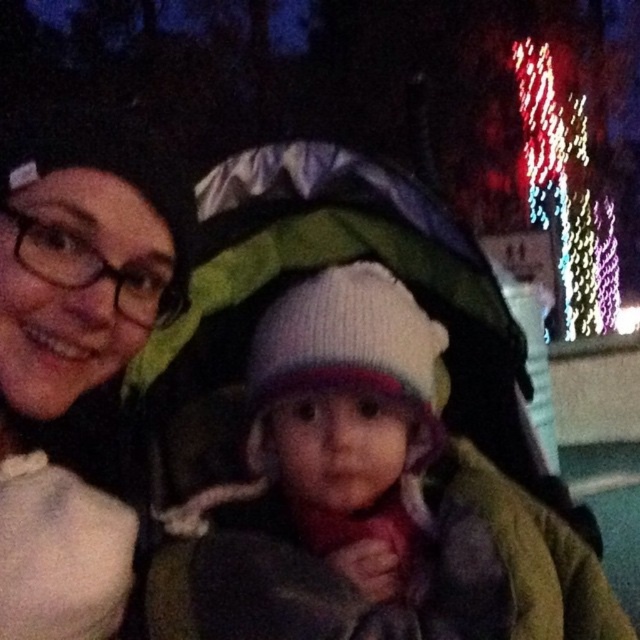
Is matte black beanie at upper left shorter than multicolored fabric baby carriage at center?

No.

Identify the location of matte black beanie at upper left. (76, 355).

The image size is (640, 640). Find the location of `matte black beanie at upper left`. matte black beanie at upper left is located at coordinates (76, 355).

Which is above, white knitted hat at center or multicolored fabric baby carriage at center?

multicolored fabric baby carriage at center is higher up.

Which is more to the left, white knitted hat at center or multicolored fabric baby carriage at center?

white knitted hat at center

Which is in front, point (216, 634) or point (499, 333)?

Point (216, 634) is more forward.

Image resolution: width=640 pixels, height=640 pixels. In order to click on white knitted hat at center in this screenshot , I will do `click(353, 472)`.

Based on the photo, who is more forward, (538, 493) or (592, 298)?

Point (538, 493) is in front.

Which is above, multicolored fabric baby carriage at center or illuminated string lights at upper right?

illuminated string lights at upper right is higher up.

What do you see at coordinates (340, 262) in the screenshot?
I see `multicolored fabric baby carriage at center` at bounding box center [340, 262].

Find the location of a particular element. multicolored fabric baby carriage at center is located at coordinates (340, 262).